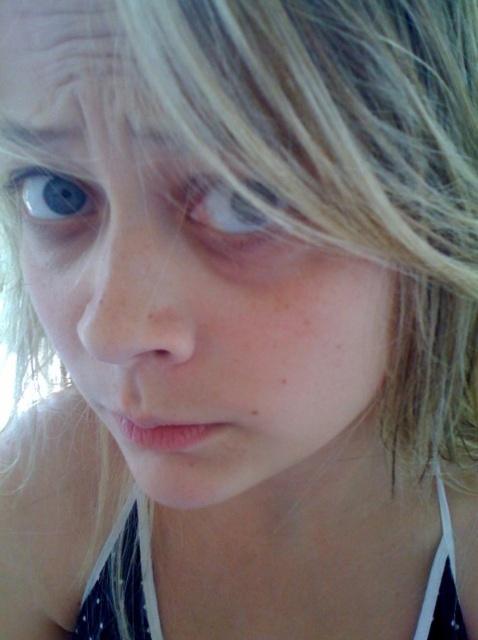
Question: Is the position of white dotted fabric bikini top at lower center more distant than that of translucent skin eye at center?

Choices:
 (A) yes
 (B) no

Answer: (A)

Question: Observing the image, what is the correct spatial positioning of white dotted fabric bikini top at lower center in reference to brown matte freckle at lower center?

Choices:
 (A) above
 (B) below

Answer: (B)

Question: From the image, what is the correct spatial relationship of blue matte eye at upper left in relation to brown matte freckle at lower center?

Choices:
 (A) below
 (B) above

Answer: (B)

Question: Which of the following is the farthest from the observer?

Choices:
 (A) brown matte freckle at lower center
 (B) translucent skin eye at center

Answer: (A)

Question: Which of the following is the farthest from the observer?

Choices:
 (A) (250, 413)
 (B) (141, 627)

Answer: (B)

Question: Which object appears farthest from the camera in this image?

Choices:
 (A) white dotted fabric bikini top at lower center
 (B) translucent skin eye at center
 (C) brown matte freckle at lower center
 (D) blue matte eye at upper left

Answer: (A)